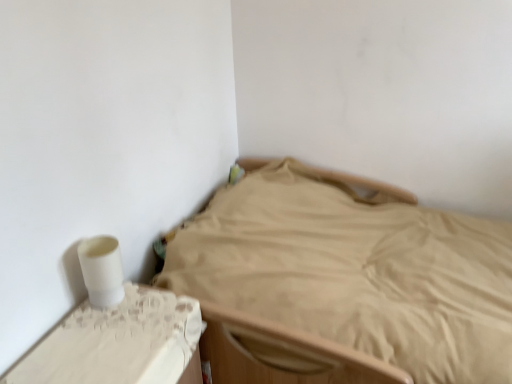
Image resolution: width=512 pixels, height=384 pixels. Describe the element at coordinates (344, 283) in the screenshot. I see `beige fabric bed at center` at that location.

Locate an element on the screen. beige fabric bed at center is located at coordinates (344, 283).

What is the approximate height of white lace table at lower left?

white lace table at lower left is 19.26 inches in height.

What do you see at coordinates (117, 342) in the screenshot? The image size is (512, 384). I see `white lace table at lower left` at bounding box center [117, 342].

What is the approximate width of white lace table at lower left?

It is 14.18 inches.

Identify the location of white lace table at lower left. Image resolution: width=512 pixels, height=384 pixels. (117, 342).

This screenshot has height=384, width=512. In order to click on beige fabric bed at center in this screenshot , I will do `click(344, 283)`.

From the picture: Visually, is beige fabric bed at center positioned to the left or to the right of white lace table at lower left?

beige fabric bed at center is to the right of white lace table at lower left.

Which object is more forward, beige fabric bed at center or white lace table at lower left?

beige fabric bed at center is more forward.

Which is nearer, (216, 290) or (129, 304)?

The point (129, 304) is more forward.

Consider the image. From the image's perspective, is beige fabric bed at center located above white lace table at lower left?

Yes.

From a real-world perspective, is beige fabric bed at center located beneath white lace table at lower left?

Correct, in the physical world, beige fabric bed at center is lower than white lace table at lower left.

Considering the sizes of objects beige fabric bed at center and white lace table at lower left in the image provided, who is wider, beige fabric bed at center or white lace table at lower left?

beige fabric bed at center.

Who is taller, beige fabric bed at center or white lace table at lower left?

beige fabric bed at center is taller.

Is beige fabric bed at center bigger or smaller than white lace table at lower left?

In the image, beige fabric bed at center appears to be larger than white lace table at lower left.

Is beige fabric bed at center spatially inside white lace table at lower left, or outside of it?

beige fabric bed at center is not enclosed by white lace table at lower left.

Is beige fabric bed at center touching white lace table at lower left?

beige fabric bed at center is not next to white lace table at lower left, and they're not touching.

Is beige fabric bed at center oriented towards white lace table at lower left?

No, beige fabric bed at center is not aimed at white lace table at lower left.

Consider the image. What's the angular difference between beige fabric bed at center and white lace table at lower left's facing directions?

There is a 179-degree angle between the facing directions of beige fabric bed at center and white lace table at lower left.

How far apart are beige fabric bed at center and white lace table at lower left?

19.18 inches.

The width and height of the screenshot is (512, 384). I want to click on furniture behind the beige fabric bed at center, so click(x=117, y=342).

Considering the positions of objects white lace table at lower left and beige fabric bed at center in the image provided, who is more to the right, white lace table at lower left or beige fabric bed at center?

From the viewer's perspective, beige fabric bed at center appears more on the right side.

Does white lace table at lower left come behind beige fabric bed at center?

Yes, white lace table at lower left is further from the viewer.

Is point (19, 364) closer to viewer compared to point (326, 282)?

Yes, point (19, 364) is closer to viewer.

From the image's perspective, relative to beige fabric bed at center, is white lace table at lower left above or below?

white lace table at lower left is below beige fabric bed at center.

From a real-world perspective, is white lace table at lower left physically located above or below beige fabric bed at center?

white lace table at lower left is situated higher than beige fabric bed at center in the real world.

Looking at their sizes, would you say white lace table at lower left is wider or thinner than beige fabric bed at center?

Considering their sizes, white lace table at lower left looks slimmer than beige fabric bed at center.

Which of these two, white lace table at lower left or beige fabric bed at center, stands taller?

beige fabric bed at center is taller.

Considering the relative sizes of white lace table at lower left and beige fabric bed at center in the image provided, is white lace table at lower left smaller than beige fabric bed at center?

Indeed, white lace table at lower left has a smaller size compared to beige fabric bed at center.

Is white lace table at lower left located outside beige fabric bed at center?

Yes, white lace table at lower left is not within beige fabric bed at center.

Are white lace table at lower left and beige fabric bed at center far apart?

No, white lace table at lower left is not far from beige fabric bed at center.

Is white lace table at lower left facing towards beige fabric bed at center?

No, white lace table at lower left is not turned towards beige fabric bed at center.

Can you tell me how much white lace table at lower left and beige fabric bed at center differ in facing direction?

The angle between the facing direction of white lace table at lower left and the facing direction of beige fabric bed at center is 179 degrees.

Locate an element on the screen. This screenshot has width=512, height=384. bed below the white lace table at lower left (from a real-world perspective) is located at coordinates (344, 283).

Where is `furniture located below the beige fabric bed at center (from the image's perspective)`? furniture located below the beige fabric bed at center (from the image's perspective) is located at coordinates (117, 342).

Identify the location of furniture behind the beige fabric bed at center. The height and width of the screenshot is (384, 512). (117, 342).